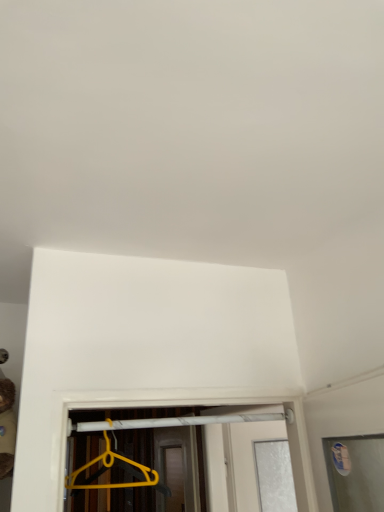
Image resolution: width=384 pixels, height=512 pixels. In order to click on yellow plastic hanger at lower center in this screenshot , I will do `click(109, 468)`.

Describe the element at coordinates (109, 468) in the screenshot. The width and height of the screenshot is (384, 512). I see `yellow plastic hanger at lower center` at that location.

You are a GUI agent. You are given a task and a screenshot of the screen. Output one action in this format:
    pyautogui.click(x=<x>, y=<y>)
    Task: Click on the yellow plastic hanger at lower center
    The height and width of the screenshot is (512, 384).
    Given the screenshot: What is the action you would take?
    pyautogui.click(x=109, y=468)